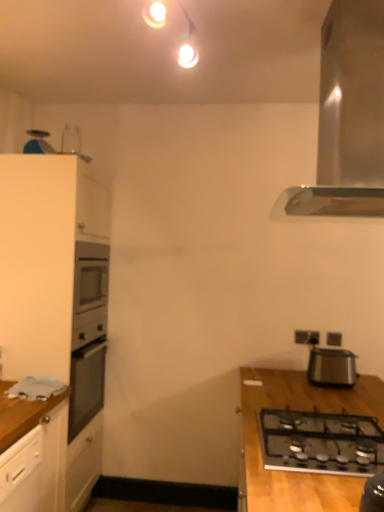
Question: Is black plastic toaster at right positioned behind black plastic electric outlet at upper right, arranged as the 1th electric outlet when viewed from the right?

Choices:
 (A) yes
 (B) no

Answer: (B)

Question: From a real-world perspective, is black plastic toaster at right over black plastic electric outlet at upper right, which is counted as the 2th electric outlet, starting from the left?

Choices:
 (A) no
 (B) yes

Answer: (A)

Question: Are black plastic toaster at right and black plastic electric outlet at upper right, which is counted as the 2th electric outlet, starting from the left, located far from each other?

Choices:
 (A) no
 (B) yes

Answer: (A)

Question: Can you confirm if black plastic toaster at right is shorter than black plastic electric outlet at upper right, arranged as the 1th electric outlet when viewed from the right?

Choices:
 (A) yes
 (B) no

Answer: (B)

Question: Can you confirm if black plastic toaster at right is bigger than black plastic electric outlet at upper right, arranged as the 1th electric outlet when viewed from the right?

Choices:
 (A) yes
 (B) no

Answer: (A)

Question: From the image's perspective, is black plastic toaster at right beneath black plastic electric outlet at upper right, arranged as the 1th electric outlet when viewed from the right?

Choices:
 (A) no
 (B) yes

Answer: (B)

Question: Is black plastic electric outlet at upper right, arranged as the 1th electric outlet when viewed from the right, further to camera compared to white plastic electric outlet at upper right, placed as the 1th electric outlet when sorted from left to right?

Choices:
 (A) no
 (B) yes

Answer: (A)

Question: Considering the relative sizes of black plastic electric outlet at upper right, which is counted as the 2th electric outlet, starting from the left, and white plastic electric outlet at upper right, marked as the 2th electric outlet in a right-to-left arrangement, in the image provided, is black plastic electric outlet at upper right, which is counted as the 2th electric outlet, starting from the left, wider than white plastic electric outlet at upper right, marked as the 2th electric outlet in a right-to-left arrangement,?

Choices:
 (A) no
 (B) yes

Answer: (A)

Question: Does black plastic electric outlet at upper right, arranged as the 1th electric outlet when viewed from the right, have a larger size compared to white plastic electric outlet at upper right, placed as the 1th electric outlet when sorted from left to right?

Choices:
 (A) yes
 (B) no

Answer: (B)

Question: Is black plastic electric outlet at upper right, which is counted as the 2th electric outlet, starting from the left, shorter than white plastic electric outlet at upper right, placed as the 1th electric outlet when sorted from left to right?

Choices:
 (A) no
 (B) yes

Answer: (B)

Question: From the image's perspective, does black plastic electric outlet at upper right, which is counted as the 2th electric outlet, starting from the left, appear lower than white plastic electric outlet at upper right, marked as the 2th electric outlet in a right-to-left arrangement?

Choices:
 (A) yes
 (B) no

Answer: (A)

Question: Can white plastic electric outlet at upper right, placed as the 1th electric outlet when sorted from left to right, be found inside black plastic electric outlet at upper right, arranged as the 1th electric outlet when viewed from the right?

Choices:
 (A) yes
 (B) no

Answer: (B)

Question: From a real-world perspective, is white plastic electric outlet at upper right, placed as the 1th electric outlet when sorted from left to right, physically below white matte cabinet at left?

Choices:
 (A) no
 (B) yes

Answer: (A)